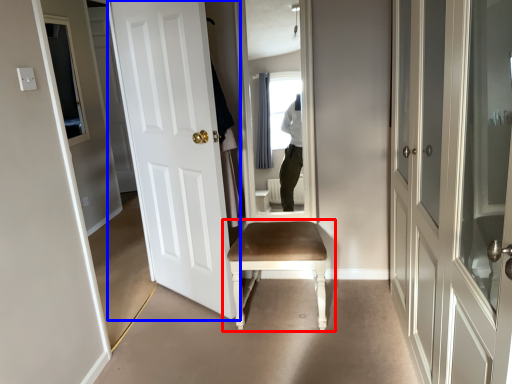
Question: Among these objects, which one is farthest to the camera, chair (highlighted by a red box) or door (highlighted by a blue box)?

Choices:
 (A) chair
 (B) door

Answer: (A)